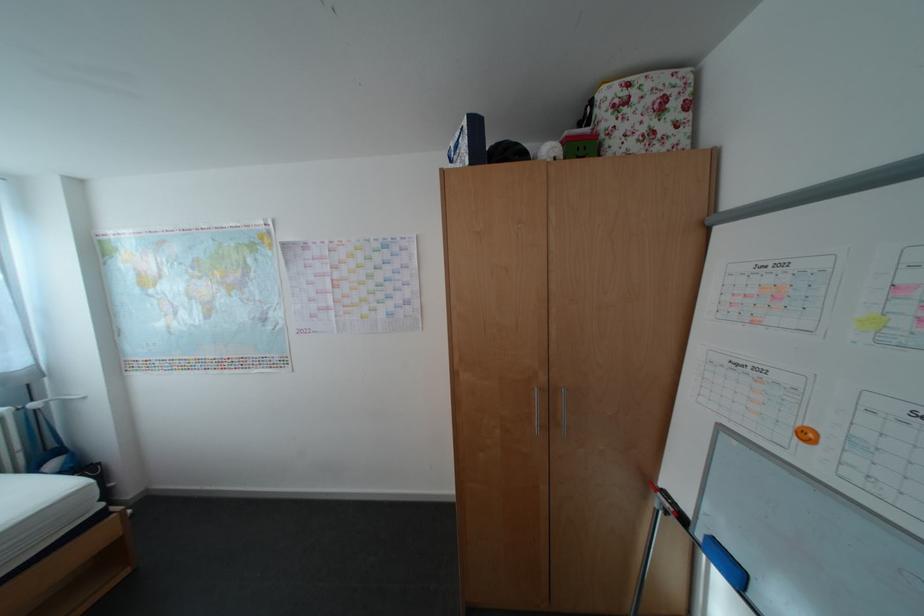
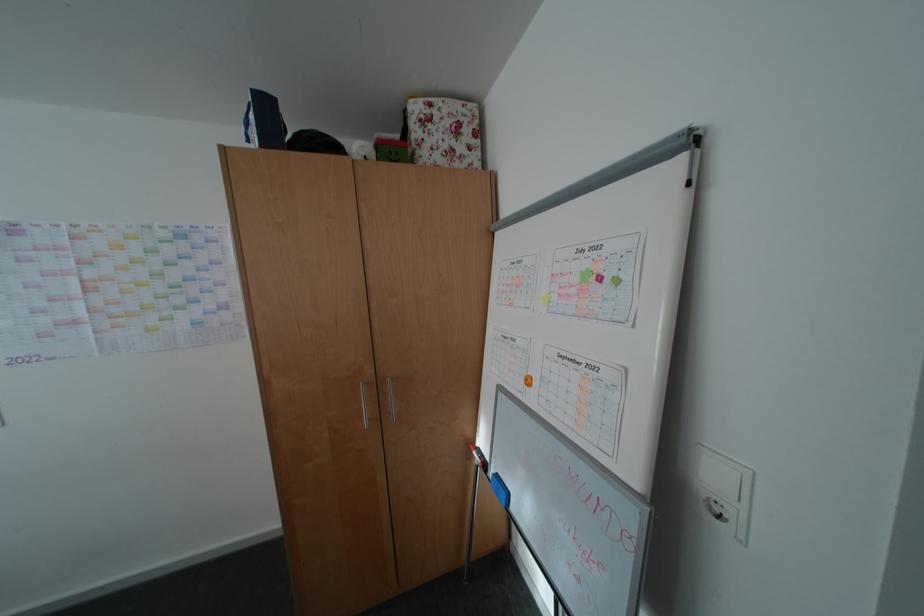
In the second image, find the point that corresponds to the point at 482,164 in the first image.

(274, 148)